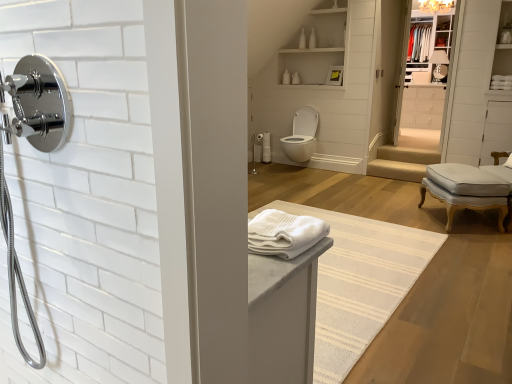
You are a GUI agent. You are given a task and a screenshot of the screen. Output one action in this format:
    pyautogui.click(x=<x>, y=<y>)
    Task: Click on the polished chrome shower at center, which is the 1th shower in back-to-front order
    The height and width of the screenshot is (384, 512).
    Given the screenshot: What is the action you would take?
    pyautogui.click(x=254, y=153)

What do you see at coordinates (37, 104) in the screenshot?
I see `polished chrome showerhead at left, positioned as the first shower in left-to-right order` at bounding box center [37, 104].

Where is `white glossy shelves at upper center, which is counted as the 1th medicine cabinet, starting from the bottom`? Image resolution: width=512 pixels, height=384 pixels. white glossy shelves at upper center, which is counted as the 1th medicine cabinet, starting from the bottom is located at coordinates (315, 48).

The width and height of the screenshot is (512, 384). What do you see at coordinates (315, 48) in the screenshot?
I see `white glossy shelves at upper center, the 2th medicine cabinet from the back` at bounding box center [315, 48].

The image size is (512, 384). Describe the element at coordinates (402, 163) in the screenshot. I see `beige fabric stair at center` at that location.

I want to click on beige fabric stair at center, so click(402, 163).

Find the location of `polished chrome shower at center, which ranks as the second shower in left-to-right order`. polished chrome shower at center, which ranks as the second shower in left-to-right order is located at coordinates (254, 153).

How different are the orientations of white glossy dresser at upper right and white glossy medicine cabinet at upper right, the second medicine cabinet from the bottom, in degrees?

178 degrees separate the facing orientations of white glossy dresser at upper right and white glossy medicine cabinet at upper right, the second medicine cabinet from the bottom.

How much distance is there between white glossy dresser at upper right and white glossy medicine cabinet at upper right, the 2th medicine cabinet viewed from the front?

The distance of white glossy dresser at upper right from white glossy medicine cabinet at upper right, the 2th medicine cabinet viewed from the front, is 5.19 inches.

Consider the image. Is white glossy medicine cabinet at upper right, arranged as the 1th medicine cabinet when viewed from the top, at the back of white glossy dresser at upper right?

That's not correct — white glossy dresser at upper right is not looking away from white glossy medicine cabinet at upper right, arranged as the 1th medicine cabinet when viewed from the top.

From the image's perspective, is white glossy dresser at upper right above or below white glossy medicine cabinet at upper right, the 2th medicine cabinet viewed from the front?

Clearly, from the image's perspective, white glossy dresser at upper right is below white glossy medicine cabinet at upper right, the 2th medicine cabinet viewed from the front.

Is white glossy dresser at upper right spatially inside light gray fabric ottoman at right, or outside of it?

white glossy dresser at upper right is not inside light gray fabric ottoman at right, it's outside.

Are white glossy dresser at upper right and light gray fabric ottoman at right far apart?

Indeed, white glossy dresser at upper right is not near light gray fabric ottoman at right.

Does white glossy dresser at upper right have a greater height compared to light gray fabric ottoman at right?

Yes.

Looking at this image, between white glossy dresser at upper right and light gray fabric ottoman at right, which one has larger width?

Wider between the two is light gray fabric ottoman at right.

Based on the photo, from a real-world perspective, does polished chrome shower at center, arranged as the first shower when viewed from the top, stand above white glossy cabinet at upper right?

No, from a real-world perspective, polished chrome shower at center, arranged as the first shower when viewed from the top, is not on top of white glossy cabinet at upper right.

Consider the image. Is polished chrome shower at center, which is the 1th shower in back-to-front order, far away from white glossy cabinet at upper right?

Yes.

Does point (253, 154) lie in front of point (421, 125)?

That is False.

Is polished chrome shower at center, arranged as the first shower when viewed from the right, aimed at white glossy cabinet at upper right?

No.

Considering the sizes of objects matte white light fixture at upper center and white glossy toilet at center in the image provided, who is taller, matte white light fixture at upper center or white glossy toilet at center?

Result: Standing taller between the two is white glossy toilet at center.

Considering the positions of point (424, 8) and point (289, 138), is point (424, 8) closer or farther from the camera than point (289, 138)?

Point (424, 8).

Does matte white light fixture at upper center have a larger size compared to white glossy toilet at center?

No.

Is white soft towel at center, the 2th bath towel when ordered from right to left, bigger than white glossy shelves at upper center, the second medicine cabinet when ordered from top to bottom?

Incorrect, white soft towel at center, the 2th bath towel when ordered from right to left, is not larger than white glossy shelves at upper center, the second medicine cabinet when ordered from top to bottom.

Which of these two, white soft towel at center, which ranks as the 2th bath towel in back-to-front order, or white glossy shelves at upper center, the second medicine cabinet when ordered from top to bottom, is thinner?

Thinner between the two is white soft towel at center, which ranks as the 2th bath towel in back-to-front order.

Does white soft towel at center, which ranks as the 1th bath towel in bottom-to-top order, appear on the right side of white glossy shelves at upper center, the second medicine cabinet from the right?

No, white soft towel at center, which ranks as the 1th bath towel in bottom-to-top order, is not to the right of white glossy shelves at upper center, the second medicine cabinet from the right.

Between white soft towel at center, which ranks as the 2th bath towel in back-to-front order, and white glossy shelves at upper center, which ranks as the 1th medicine cabinet in left-to-right order, which one is positioned behind?

white glossy shelves at upper center, which ranks as the 1th medicine cabinet in left-to-right order, is more distant.

Visually, is white glossy cabinet at upper right positioned to the left or to the right of white glossy dresser at upper right?

In the image, white glossy cabinet at upper right appears on the right side of white glossy dresser at upper right.

Is white glossy cabinet at upper right not close to white glossy dresser at upper right?

No, there isn't a large distance between white glossy cabinet at upper right and white glossy dresser at upper right.

Find the location of a particular element. This screenshot has width=512, height=384. dresser to the left of white glossy cabinet at upper right is located at coordinates (428, 76).

Considering the points (444, 104) and (449, 19), which point is in front, point (444, 104) or point (449, 19)?

The point (449, 19) is closer to the camera.

Considering the relative sizes of light gray fabric ottoman at right and white glossy medicine cabinet at upper right, placed as the first medicine cabinet when sorted from back to front, in the image provided, is light gray fabric ottoman at right taller than white glossy medicine cabinet at upper right, placed as the first medicine cabinet when sorted from back to front,?

No, light gray fabric ottoman at right is not taller than white glossy medicine cabinet at upper right, placed as the first medicine cabinet when sorted from back to front.

Looking at the image, does light gray fabric ottoman at right seem bigger or smaller compared to white glossy medicine cabinet at upper right, arranged as the 1th medicine cabinet when viewed from the top?

In the image, light gray fabric ottoman at right appears to be smaller than white glossy medicine cabinet at upper right, arranged as the 1th medicine cabinet when viewed from the top.

From the image's perspective, is light gray fabric ottoman at right over white glossy medicine cabinet at upper right, which is the second medicine cabinet in left-to-right order?

No, from the image's perspective, light gray fabric ottoman at right is not over white glossy medicine cabinet at upper right, which is the second medicine cabinet in left-to-right order.

The height and width of the screenshot is (384, 512). I want to click on chair below the white glossy medicine cabinet at upper right, placed as the first medicine cabinet when sorted from back to front (from a real-world perspective), so click(x=465, y=189).

From a real-world perspective, which medicine cabinet is the 2nd one above the white glossy dresser at upper right? Please provide its 2D coordinates.

[(428, 45)]

Where is `chair directly beneath the white glossy dresser at upper right (from a real-world perspective)`? This screenshot has width=512, height=384. chair directly beneath the white glossy dresser at upper right (from a real-world perspective) is located at coordinates (465, 189).

Estimate the real-world distances between objects in this image. Which object is further from light gray fabric ottoman at right, matte white light fixture at upper center or polished chrome showerhead at left, acting as the second shower starting from the top?

polished chrome showerhead at left, acting as the second shower starting from the top, lies further to light gray fabric ottoman at right than the other object.

Based on their spatial positions, is polished chrome shower at center, which is the 1th shower in back-to-front order, or polished chrome showerhead at left, which ranks as the second shower in back-to-front order, further from light gray fabric ottoman at right?

Among the two, polished chrome showerhead at left, which ranks as the second shower in back-to-front order, is located further to light gray fabric ottoman at right.

Looking at the image, which one is located further to white glossy medicine cabinet at upper right, which is the second medicine cabinet in left-to-right order, matte white light fixture at upper center or white glossy dresser at upper right?

matte white light fixture at upper center is positioned further to the anchor white glossy medicine cabinet at upper right, which is the second medicine cabinet in left-to-right order.

When comparing their distances from white soft towel at center, the 2th bath towel when ordered from right to left, does white glossy toilet at center or beige fabric stair at center seem closer?

beige fabric stair at center lies closer to white soft towel at center, the 2th bath towel when ordered from right to left, than the other object.

When comparing their distances from white glossy medicine cabinet at upper right, the 2th medicine cabinet viewed from the front, does white glossy shelves at upper center, positioned as the first medicine cabinet in front-to-back order, or white glossy dresser at upper right seem further?

white glossy shelves at upper center, positioned as the first medicine cabinet in front-to-back order.

Estimate the real-world distances between objects in this image. Which object is closer to matte white light fixture at upper center, polished chrome showerhead at left, positioned as the first shower in left-to-right order, or white cotton bath towel at center, arranged as the first bath towel when viewed from the right?

white cotton bath towel at center, arranged as the first bath towel when viewed from the right.

Based on their spatial positions, is light gray fabric ottoman at right or white glossy toilet at center further from white glossy cabinet at upper right?

light gray fabric ottoman at right lies further to white glossy cabinet at upper right than the other object.

When comparing their distances from white soft towel at center, the 2th bath towel when ordered from right to left, does matte white light fixture at upper center or white glossy dresser at upper right seem further?

matte white light fixture at upper center.

Identify the location of cabinetry between white glossy toilet at center and white glossy medicine cabinet at upper right, which is the first medicine cabinet from right to left, from left to right. This screenshot has width=512, height=384. (422, 107).

Image resolution: width=512 pixels, height=384 pixels. Identify the location of medicine cabinet between white glossy toilet at center and matte white light fixture at upper center from left to right. (315, 48).

This screenshot has width=512, height=384. I want to click on toilet between light gray fabric ottoman at right and polished chrome shower at center, which is the 1th shower in back-to-front order, from front to back, so click(302, 135).

In order to click on toilet between polished chrome shower at center, marked as the 2th shower in a bottom-to-top arrangement, and white glossy cabinet at upper right from left to right in this screenshot , I will do `click(302, 135)`.